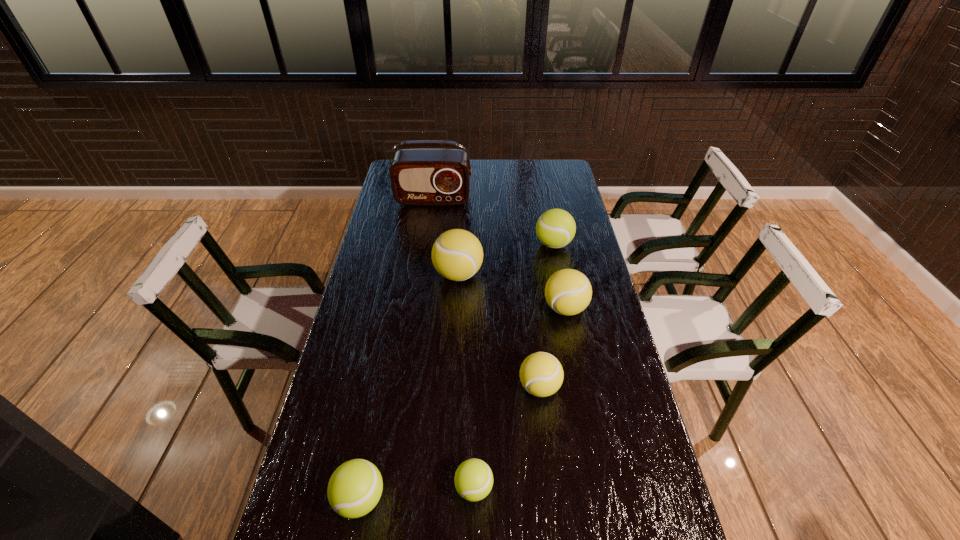
Identify which green tennis ball is the closest to the smallest green tennis ball. Please provide its 2D coordinates. Your answer should be formatted as a tuple, i.e. [(x, y)], where the tuple contains the x and y coordinates of a point satisfying the conditions above.

[(354, 489)]

Identify which green tennis ball is the nearest to the leftmost green tennis ball. Please provide its 2D coordinates. Your answer should be formatted as a tuple, i.e. [(x, y)], where the tuple contains the x and y coordinates of a point satisfying the conditions above.

[(473, 480)]